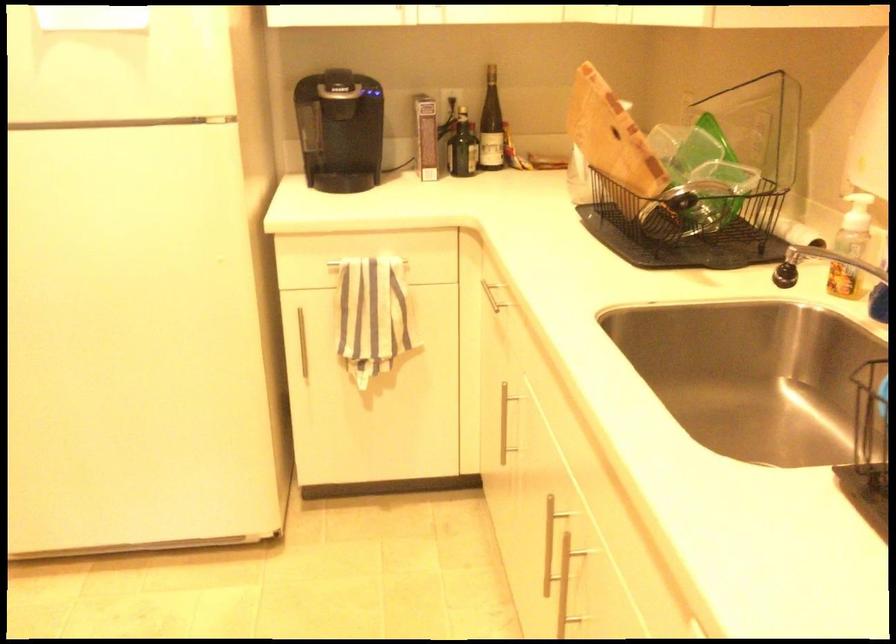
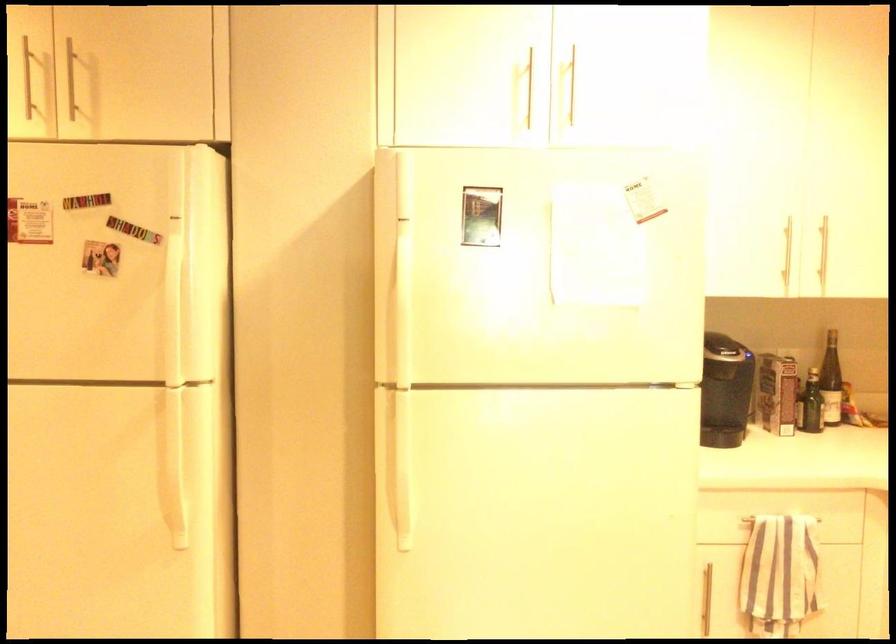
In the second image, find the point that corresponds to point 415,137 in the first image.

(777, 393)